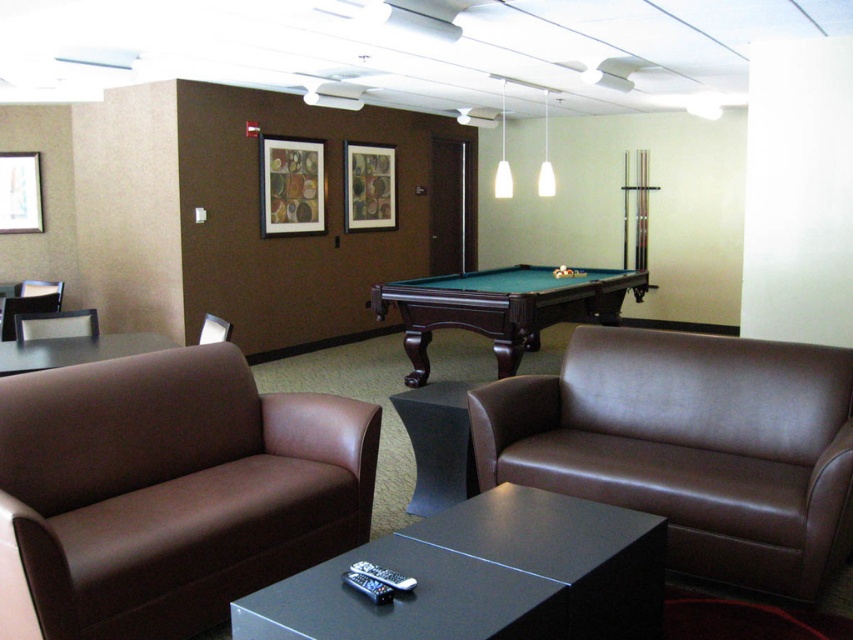
Question: Which object is closer to the camera taking this photo?

Choices:
 (A) black glossy coffee table at center
 (B) matte white picture frame at upper left
 (C) black glass table at lower left
 (D) matte black picture frame at upper center

Answer: (A)

Question: Can you confirm if matte brown armchair at left is bigger than brown leather chair at center?

Choices:
 (A) yes
 (B) no

Answer: (A)

Question: Which point appears farthest from the camera in this image?

Choices:
 (A) (477, 529)
 (B) (607, 403)
 (C) (125, 404)

Answer: (B)

Question: From the image, what is the correct spatial relationship of black glossy coffee table at center in relation to matte black picture frame at upper center?

Choices:
 (A) below
 (B) above

Answer: (A)

Question: Is brown leather swivel chair at lower left wider than matte black picture frame at upper center?

Choices:
 (A) yes
 (B) no

Answer: (A)

Question: Which point is closer to the camera taking this photo?

Choices:
 (A) (38, 212)
 (B) (498, 349)
 (C) (372, 164)

Answer: (B)